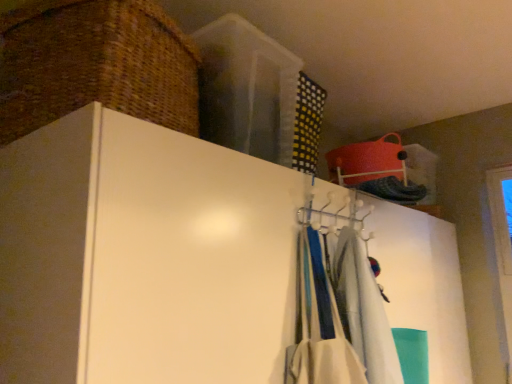
Question: From the image's perspective, is woven brown basket at upper left under white plastic hanger at upper center?

Choices:
 (A) yes
 (B) no

Answer: (B)

Question: Is white plastic hanger at upper center at the back of woven brown basket at upper left?

Choices:
 (A) no
 (B) yes

Answer: (A)

Question: Is woven brown basket at upper left oriented towards white plastic hanger at upper center?

Choices:
 (A) yes
 (B) no

Answer: (B)

Question: From a real-world perspective, is woven brown basket at upper left positioned over white plastic hanger at upper center based on gravity?

Choices:
 (A) no
 (B) yes

Answer: (B)

Question: Are woven brown basket at upper left and white plastic hanger at upper center making contact?

Choices:
 (A) yes
 (B) no

Answer: (B)

Question: Is the depth of woven brown basket at upper left less than that of white plastic hanger at upper center?

Choices:
 (A) no
 (B) yes

Answer: (B)

Question: Does white fabric scarf at center have a lesser height compared to white plastic hanger at upper center?

Choices:
 (A) no
 (B) yes

Answer: (A)

Question: Can you confirm if white fabric scarf at center is positioned to the right of white plastic hanger at upper center?

Choices:
 (A) no
 (B) yes

Answer: (B)

Question: Is white fabric scarf at center positioned far away from white plastic hanger at upper center?

Choices:
 (A) no
 (B) yes

Answer: (A)

Question: Is white fabric scarf at center further to camera compared to white plastic hanger at upper center?

Choices:
 (A) yes
 (B) no

Answer: (A)

Question: Is white fabric scarf at center smaller than white plastic hanger at upper center?

Choices:
 (A) no
 (B) yes

Answer: (B)

Question: Does white fabric scarf at center have a larger size compared to white plastic hanger at upper center?

Choices:
 (A) no
 (B) yes

Answer: (A)

Question: Does white fabric scarf at center appear on the left side of woven brown basket at upper left?

Choices:
 (A) yes
 (B) no

Answer: (B)